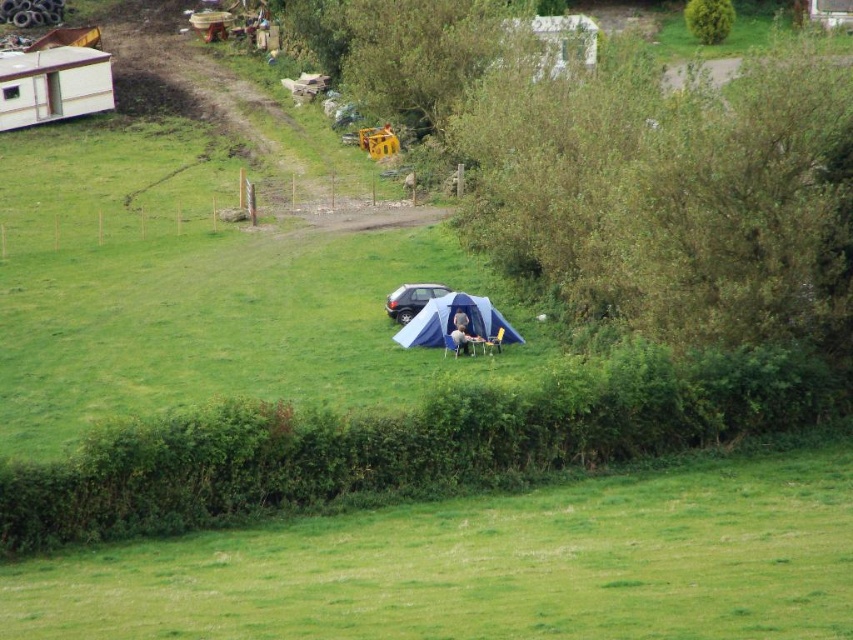
Which is more to the right, green leafy hedge at center right or green leafy hedge at lower center?

From the viewer's perspective, green leafy hedge at center right appears more on the right side.

Does green leafy hedge at center right appear on the left side of green leafy hedge at lower center?

No, green leafy hedge at center right is not to the left of green leafy hedge at lower center.

Where is `green leafy hedge at center right`? The image size is (853, 640). green leafy hedge at center right is located at coordinates click(x=672, y=195).

Between satin silver car at center and light brown fabric man at center, which one is positioned higher?

Positioned higher is satin silver car at center.

Which is behind, point (413, 292) or point (477, 340)?

The point (413, 292) is more distant.

You are a GUI agent. You are given a task and a screenshot of the screen. Output one action in this format:
    pyautogui.click(x=<x>, y=<y>)
    Task: Click on the satin silver car at center
    The image size is (853, 640).
    Given the screenshot: What is the action you would take?
    pyautogui.click(x=410, y=300)

This screenshot has width=853, height=640. I want to click on green leafy hedge at lower center, so click(405, 444).

I want to click on green leafy hedge at lower center, so pyautogui.click(x=405, y=444).